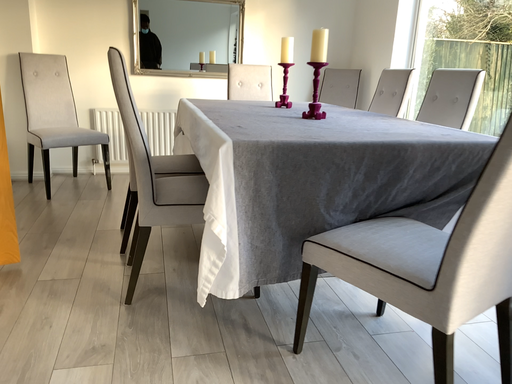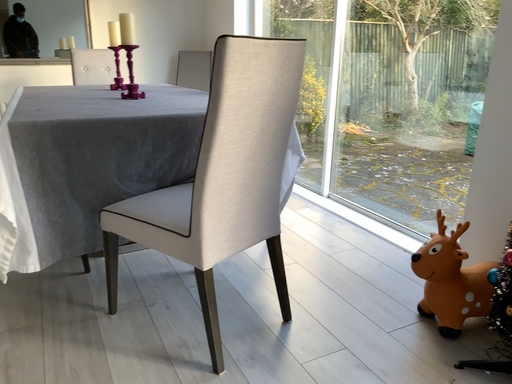
Question: Which way did the camera rotate in the video?

Choices:
 (A) rotated left
 (B) rotated right

Answer: (B)